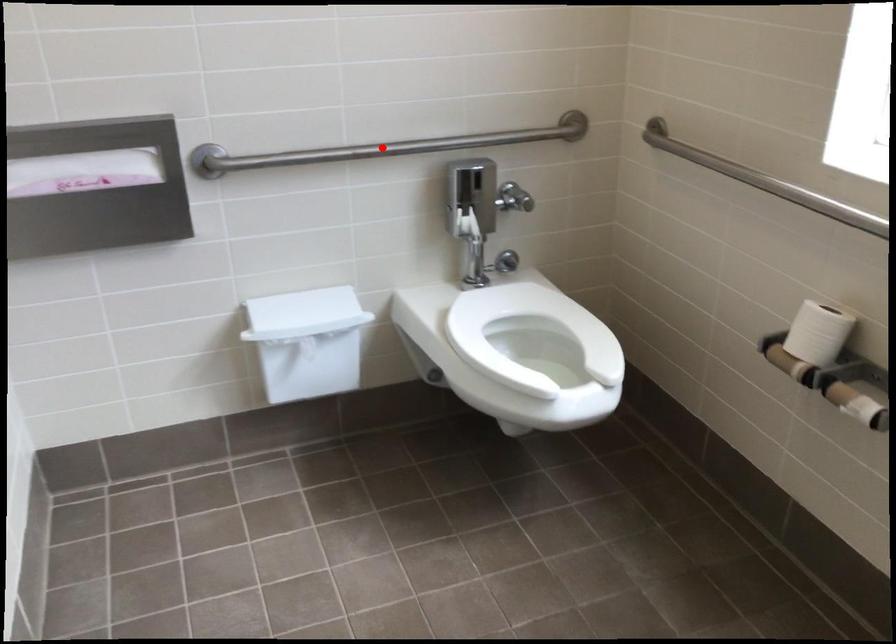
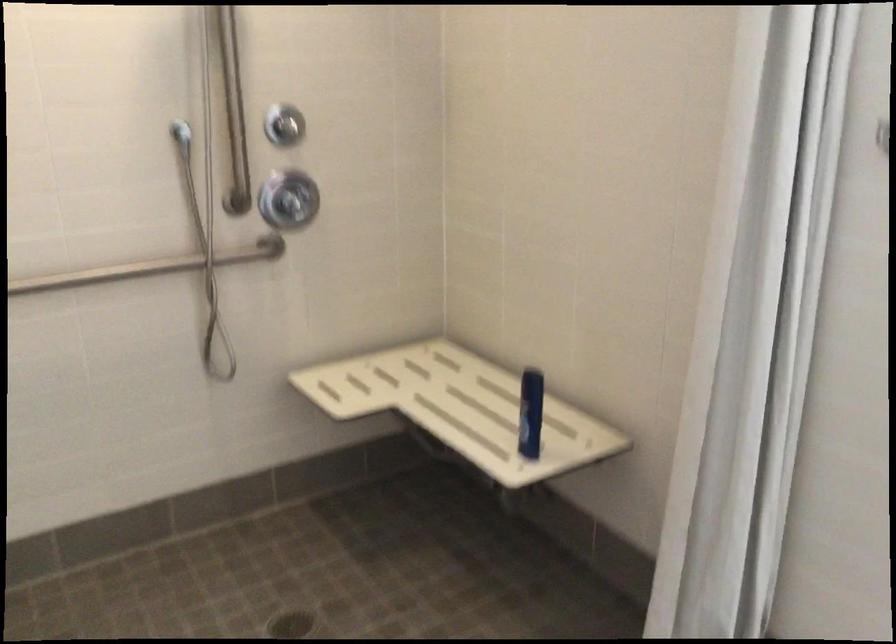
Question: I am providing you with two images of the same scene from different viewpoints. A red point is marked on the first image. Is the red point's position out of view in image 2?

Choices:
 (A) Yes
 (B) No

Answer: (A)